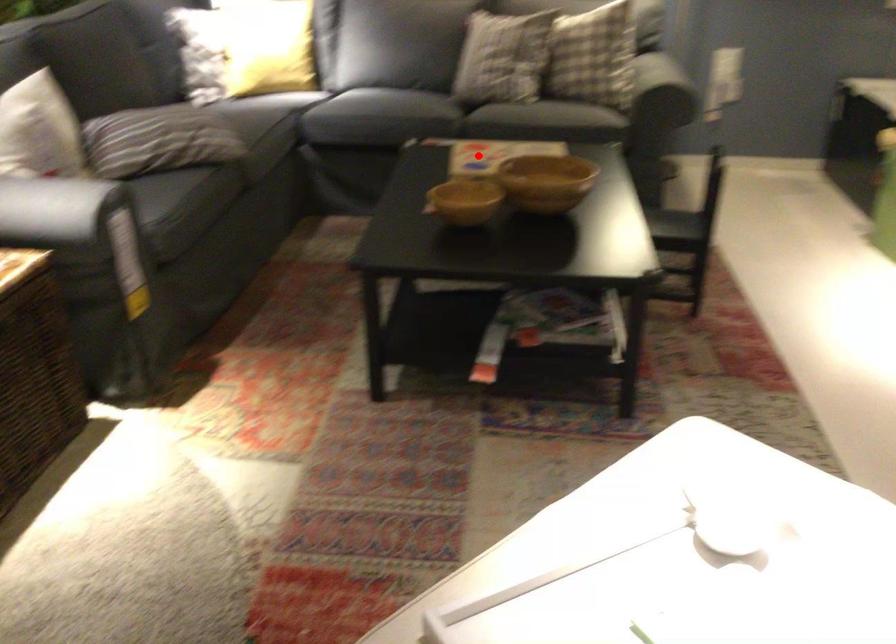
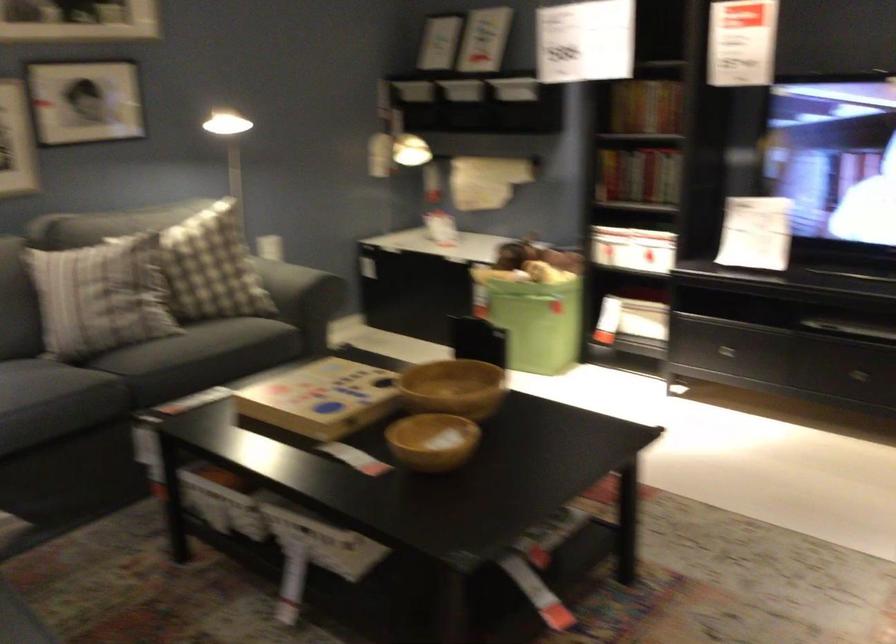
The point at the highlighted location is marked in the first image. Where is the corresponding point in the second image?

(320, 399)